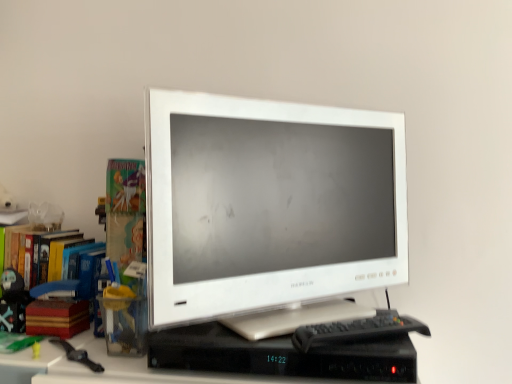
I want to click on free point below white glossy monitor at center (from a real-world perspective), so 287,325.